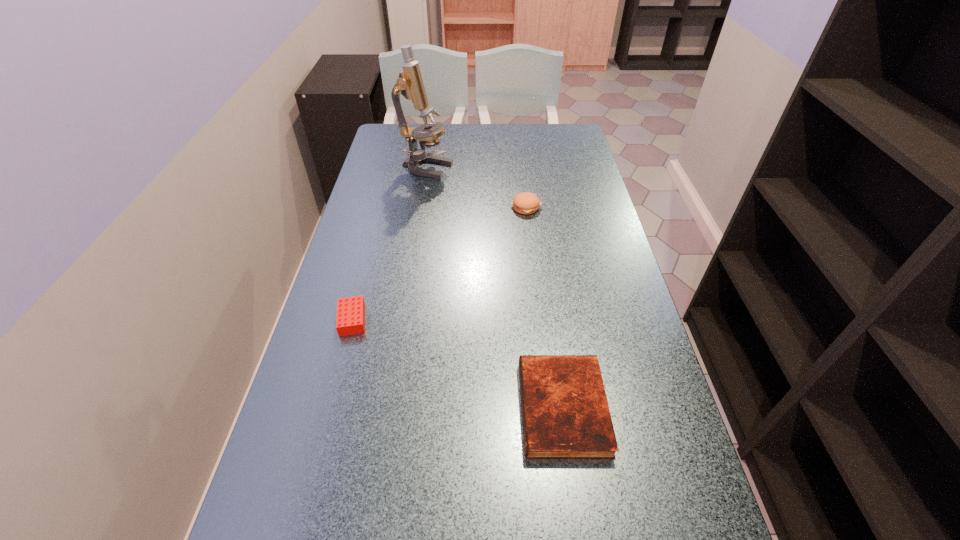
Where is `vacant space situated 0.270m on the spine side of the Bible`? vacant space situated 0.270m on the spine side of the Bible is located at coordinates (387, 408).

Identify the location of microscope at the left edge. (410, 84).

Where is `Lego situated at the left edge`? This screenshot has height=540, width=960. Lego situated at the left edge is located at coordinates [350, 319].

At what (x,y) coordinates should I click in order to perform the action: click on object that is at the right edge. Please return your answer as a coordinate pair (x, y). Image resolution: width=960 pixels, height=540 pixels. Looking at the image, I should click on (565, 412).

Find the location of a particular element. vacant space at the far edge is located at coordinates (492, 125).

At what (x,y) coordinates should I click in order to perform the action: click on vacant space at the left edge. Please return your answer as a coordinate pair (x, y). Looking at the image, I should click on (302, 474).

The width and height of the screenshot is (960, 540). I want to click on free region at the right edge of the desktop, so click(x=590, y=227).

What are the coordinates of `free space at the far left corner` in the screenshot? It's located at (393, 130).

Where is `vacant space at the far right corner of the desktop`? Image resolution: width=960 pixels, height=540 pixels. vacant space at the far right corner of the desktop is located at coordinates (540, 128).

You are a GUI agent. You are given a task and a screenshot of the screen. Output one action in this format:
    pyautogui.click(x=<x>, y=<y>)
    Task: Click on the free space between the second farthest object and the third farthest object
    This screenshot has width=960, height=540.
    Given the screenshot: What is the action you would take?
    pyautogui.click(x=440, y=263)